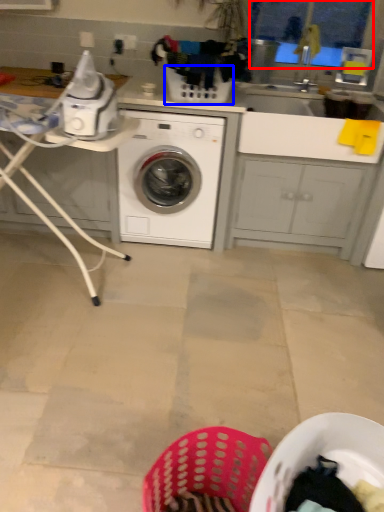
Question: Which object is further to the camera taking this photo, window screen (highlighted by a red box) or basket (highlighted by a blue box)?

Choices:
 (A) window screen
 (B) basket

Answer: (A)